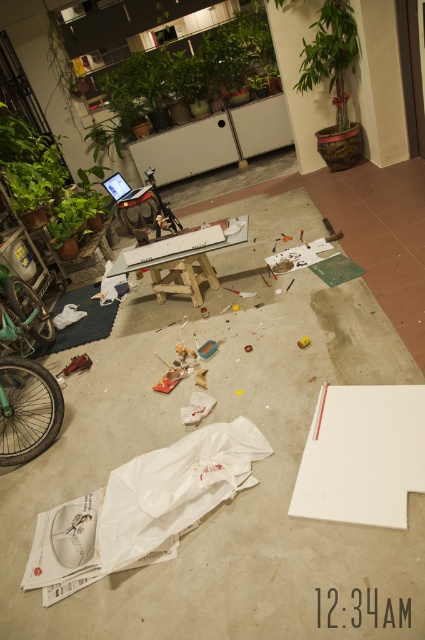
You are standing in the workshop and want to move from the point marked as point [96,454] to the point marked as point [169,276]. According to the coordinates, which direction should you move to reach your destination?

To move from point [96,454] to point [169,276], you should move towards the upper right direction since the destination point has a higher x and y coordinate compared to the starting point.